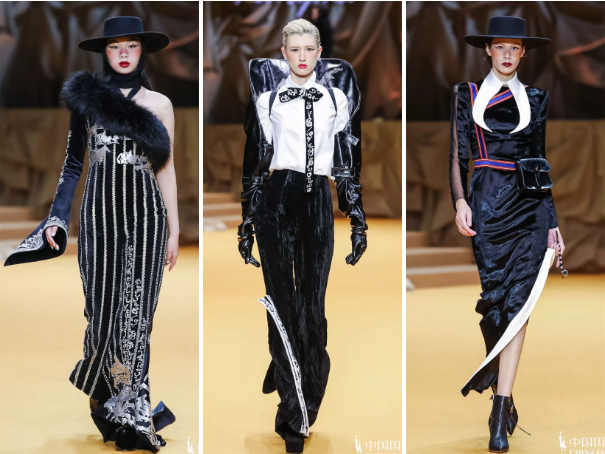
I want to click on tan floor, so click(x=39, y=342).